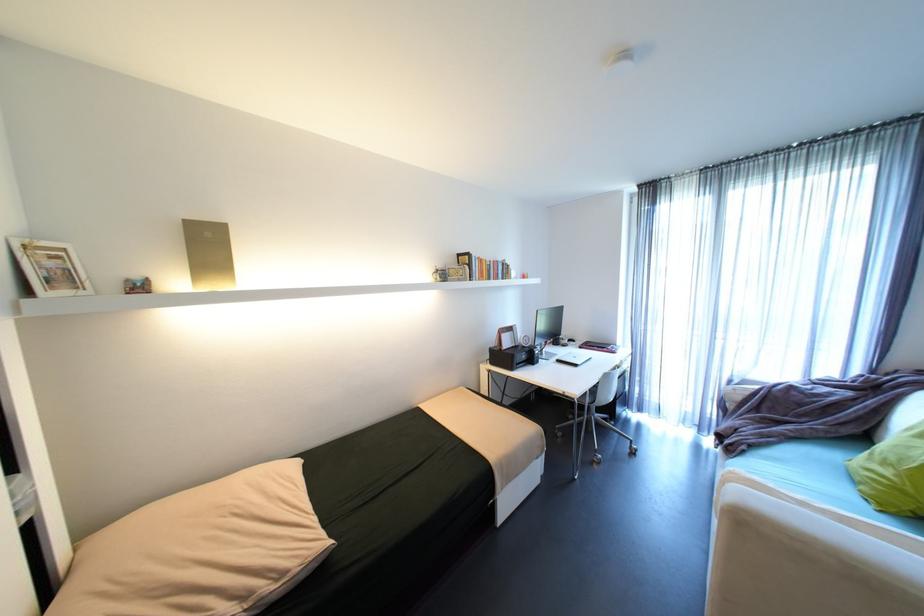
At what (x,y) coordinates should I click in order to perform the action: click on green pillow. Please return your answer as a coordinate pair (x, y). Image resolution: width=924 pixels, height=616 pixels. Looking at the image, I should click on (893, 472).